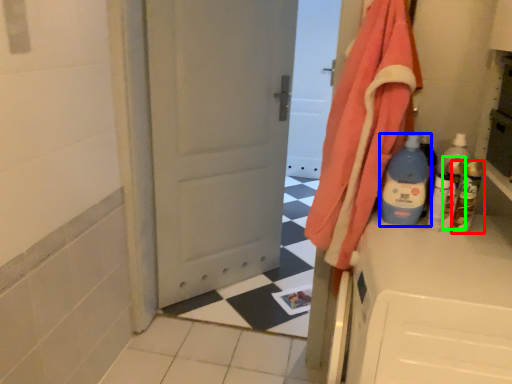
Question: Which is nearer to the bottle (highlighted by a red box)? bottle (highlighted by a blue box) or bottle (highlighted by a green box).

Choices:
 (A) bottle
 (B) bottle

Answer: (B)